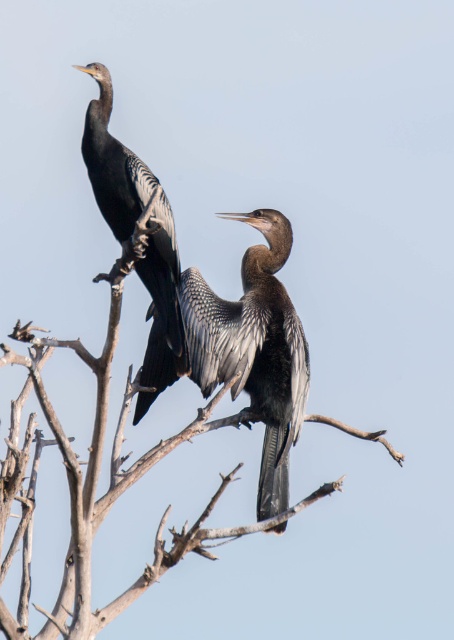
From the picture: You are observing two birds in a tree. You see the dark gray feathers at center and the shiny black bird at left. Which one is located to the right of the other?

The dark gray feathers at center is positioned on the right side of shiny black bird at left.

You are a birdwatcher observing the scene. You notice the brown wood tree at center and the shiny black bird at left. Which object is positioned lower in the image?

The brown wood tree at center is positioned lower than the shiny black bird at left according to the description.